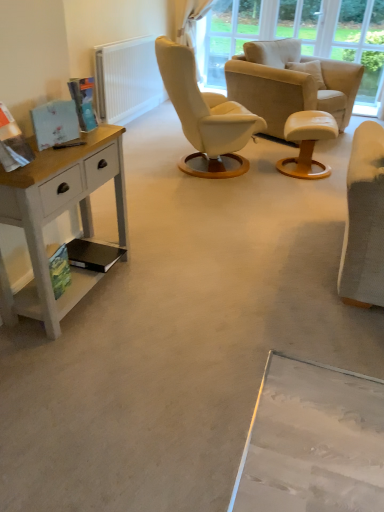
Question: Does transparent glass window screen at upper center appear on the left side of white leather stool at center?

Choices:
 (A) yes
 (B) no

Answer: (A)

Question: Is transparent glass window screen at upper center directly adjacent to white leather stool at center?

Choices:
 (A) no
 (B) yes

Answer: (A)

Question: Is transparent glass window screen at upper center oriented towards white leather stool at center?

Choices:
 (A) no
 (B) yes

Answer: (A)

Question: Is transparent glass window screen at upper center bigger than white leather stool at center?

Choices:
 (A) no
 (B) yes

Answer: (B)

Question: Is transparent glass window screen at upper center not near white leather stool at center?

Choices:
 (A) no
 (B) yes

Answer: (B)

Question: Considering their positions, is transparent glass window screen at upper center located in front of or behind white painted wood desk at left?

Choices:
 (A) front
 (B) behind

Answer: (B)

Question: Is transparent glass window screen at upper center inside the boundaries of white painted wood desk at left, or outside?

Choices:
 (A) inside
 (B) outside

Answer: (B)

Question: Is point (256, 37) positioned closer to the camera than point (119, 190)?

Choices:
 (A) farther
 (B) closer

Answer: (A)

Question: From the image's perspective, relative to white painted wood desk at left, is transparent glass window screen at upper center above or below?

Choices:
 (A) above
 (B) below

Answer: (A)

Question: Is white leather stool at center to the left or to the right of white painted wood desk at left in the image?

Choices:
 (A) left
 (B) right

Answer: (B)

Question: Is white leather stool at center inside or outside of white painted wood desk at left?

Choices:
 (A) outside
 (B) inside

Answer: (A)

Question: From the image's perspective, is white leather stool at center positioned above or below white painted wood desk at left?

Choices:
 (A) above
 (B) below

Answer: (A)

Question: Based on their sizes in the image, would you say white leather stool at center is bigger or smaller than white painted wood desk at left?

Choices:
 (A) big
 (B) small

Answer: (B)

Question: In the image, is white textured radiator at upper left positioned in front of or behind transparent glass window screen at upper center?

Choices:
 (A) front
 (B) behind

Answer: (A)

Question: From the image's perspective, relative to transparent glass window screen at upper center, is white textured radiator at upper left above or below?

Choices:
 (A) above
 (B) below

Answer: (B)